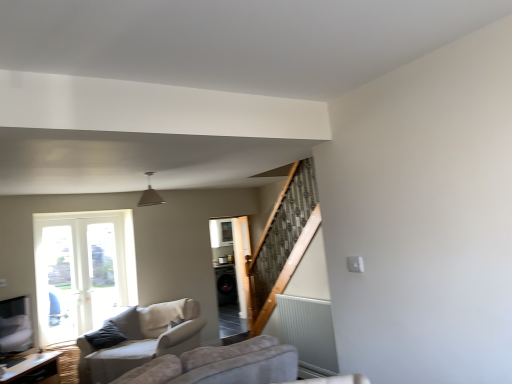
Question: Is matte gray pendant light at center to the left of wooden table at lower left from the viewer's perspective?

Choices:
 (A) yes
 (B) no

Answer: (B)

Question: Considering the relative sizes of matte gray pendant light at center and wooden table at lower left in the image provided, is matte gray pendant light at center bigger than wooden table at lower left?

Choices:
 (A) no
 (B) yes

Answer: (A)

Question: Is matte gray pendant light at center facing away from wooden table at lower left?

Choices:
 (A) yes
 (B) no

Answer: (B)

Question: Is matte gray pendant light at center far away from wooden table at lower left?

Choices:
 (A) yes
 (B) no

Answer: (A)

Question: Considering the relative sizes of matte gray pendant light at center and wooden table at lower left in the image provided, is matte gray pendant light at center wider than wooden table at lower left?

Choices:
 (A) no
 (B) yes

Answer: (A)

Question: In terms of width, does beige fabric couch at lower left look wider or thinner when compared to black glossy screen door at center?

Choices:
 (A) wide
 (B) thin

Answer: (A)

Question: From a real-world perspective, is beige fabric couch at lower left above or below black glossy screen door at center?

Choices:
 (A) above
 (B) below

Answer: (B)

Question: Does point (122, 355) appear closer or farther from the camera than point (238, 286)?

Choices:
 (A) farther
 (B) closer

Answer: (B)

Question: In the image, is beige fabric couch at lower left positioned in front of or behind black glossy screen door at center?

Choices:
 (A) behind
 (B) front

Answer: (B)

Question: Considering the relative positions of black glossy screen door at center and beige fabric couch at lower left in the image provided, is black glossy screen door at center to the left or to the right of beige fabric couch at lower left?

Choices:
 (A) left
 (B) right

Answer: (B)

Question: In terms of size, does black glossy screen door at center appear bigger or smaller than beige fabric couch at lower left?

Choices:
 (A) small
 (B) big

Answer: (A)

Question: Looking at their shapes, would you say black glossy screen door at center is wider or thinner than beige fabric couch at lower left?

Choices:
 (A) wide
 (B) thin

Answer: (B)

Question: In the image, is black glossy screen door at center positioned in front of or behind beige fabric couch at lower left?

Choices:
 (A) behind
 (B) front

Answer: (A)

Question: Is wooden table at lower left taller or shorter than black glossy screen door at center?

Choices:
 (A) tall
 (B) short

Answer: (B)

Question: Is point [x=32, y=380] positioned closer to the camera than point [x=215, y=269]?

Choices:
 (A) closer
 (B) farther

Answer: (A)